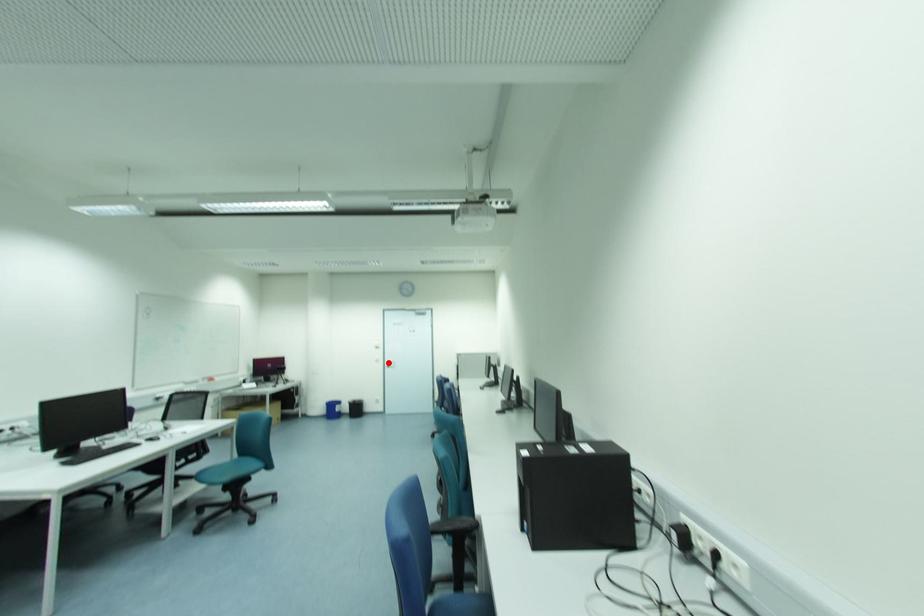
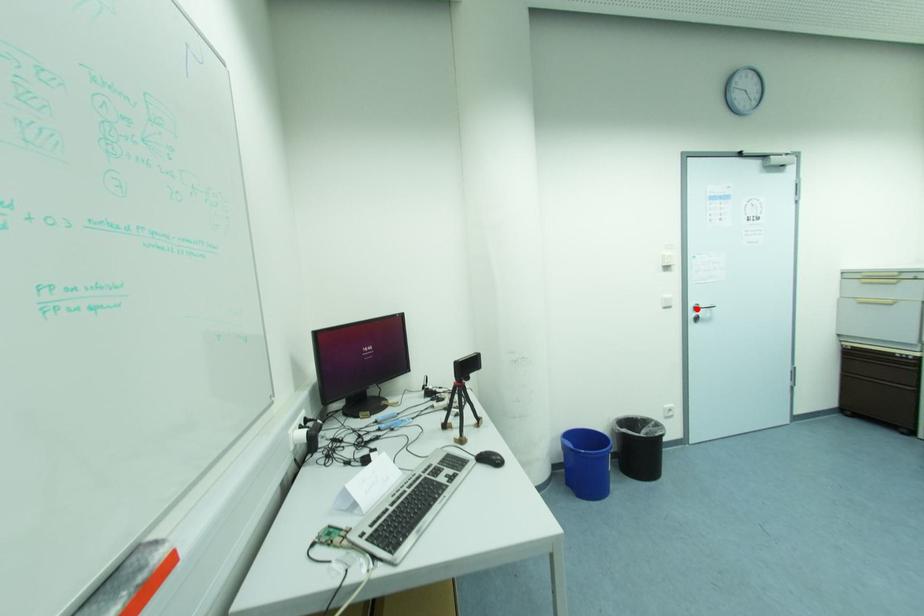
I am providing you with two images of the same scene from different viewpoints. A red point is marked on the first image and another point is marked on the second image. Do the highlighted points in image1 and image2 indicate the same real-world spot?

Yes